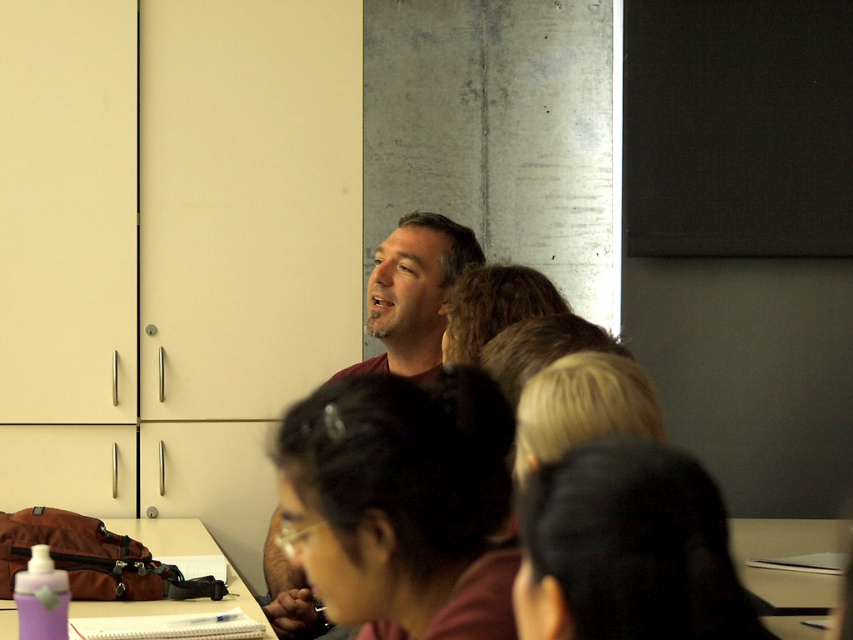
Is point (424, 342) closer to camera compared to point (4, 625)?

No, (424, 342) is behind (4, 625).

Measure the distance between matte maroon shirt at center and purple plastic water bottle at lower left.

A distance of 33.89 inches exists between matte maroon shirt at center and purple plastic water bottle at lower left.

Measure the distance between matte maroon shirt at center and camera.

matte maroon shirt at center and camera are 7.88 feet apart.

Where is `matte maroon shirt at center`? matte maroon shirt at center is located at coordinates (416, 289).